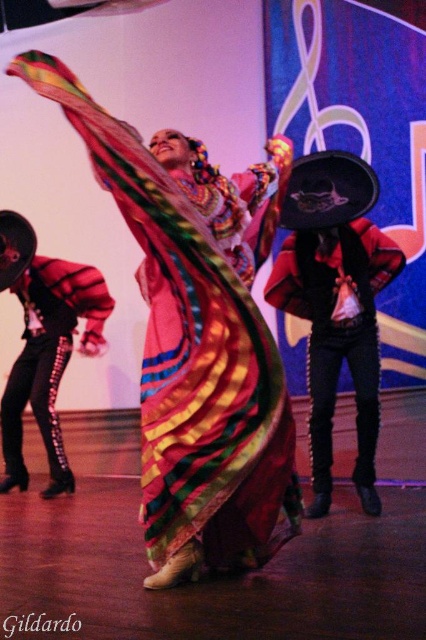
Question: Is velvet black sombrero at center closer to camera compared to brushed metal sombrero at left?

Choices:
 (A) no
 (B) yes

Answer: (B)

Question: Considering the real-world distances, which object is closest to the silky multicolored skirt at center?

Choices:
 (A) brushed metal sombrero at left
 (B) velvet black sombrero at center

Answer: (B)

Question: Which of these objects is positioned closest to the brushed metal sombrero at left?

Choices:
 (A) velvet black sombrero at center
 (B) silky multicolored skirt at center

Answer: (A)

Question: Which of the following is the closest to the observer?

Choices:
 (A) (294, 304)
 (B) (51, 451)

Answer: (A)

Question: Does silky multicolored skirt at center appear on the left side of velvet black sombrero at center?

Choices:
 (A) no
 (B) yes

Answer: (B)

Question: Does silky multicolored skirt at center have a lesser width compared to brushed metal sombrero at left?

Choices:
 (A) no
 (B) yes

Answer: (A)